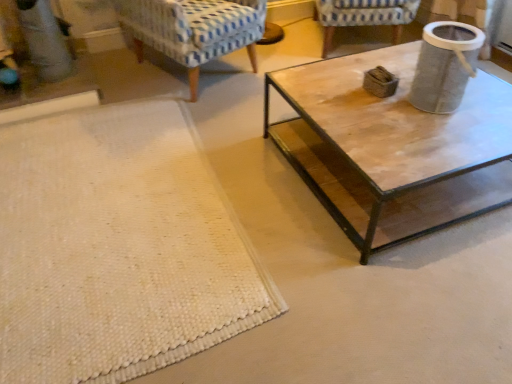
Image resolution: width=512 pixels, height=384 pixels. I want to click on white woven mat at lower left, so click(117, 248).

What is the approximate width of blue-patterned fabric chair at upper center, the 2th chair from the left?

The width of blue-patterned fabric chair at upper center, the 2th chair from the left, is 33.92 inches.

Describe the element at coordinates (445, 66) in the screenshot. The width and height of the screenshot is (512, 384). I see `textured gray trash can at upper right` at that location.

The image size is (512, 384). What are the coordinates of `blue patterned fabric chair at upper left, which is the 2th chair from right to left` in the screenshot? It's located at (193, 29).

Is white woven mat at lower left positioned far away from blue-patterned fabric chair at upper center, the 2th chair from the left?

Absolutely, white woven mat at lower left is distant from blue-patterned fabric chair at upper center, the 2th chair from the left.

Which is less distant, (141, 160) or (414, 1)?

The point (141, 160) is closer to the camera.

From the image's perspective, is white woven mat at lower left above or below blue-patterned fabric chair at upper center, which is the first chair from right to left?

From the image's perspective, white woven mat at lower left appears below blue-patterned fabric chair at upper center, which is the first chair from right to left.

Relative to textured gray trash can at upper right, is white woven mat at lower left in front or behind?

Visually, white woven mat at lower left is located in front of textured gray trash can at upper right.

Considering the relative positions of white woven mat at lower left and textured gray trash can at upper right in the image provided, is white woven mat at lower left to the left of textured gray trash can at upper right from the viewer's perspective?

Yes.

At what (x,y) coordinates should I click in order to perform the action: click on gray behind the white woven mat at lower left. Please return your answer as a coordinate pair (x, y). The width and height of the screenshot is (512, 384). Looking at the image, I should click on (445, 66).

Is textured gray trash can at upper right situated inside blue patterned fabric chair at upper left, which appears as the first chair when viewed from the left, or outside?

The correct answer is: outside.

Between textured gray trash can at upper right and blue patterned fabric chair at upper left, which is the 2th chair from right to left, which one has less height?

textured gray trash can at upper right is shorter.

Between textured gray trash can at upper right and blue patterned fabric chair at upper left, which appears as the first chair when viewed from the left, which one appears on the left side from the viewer's perspective?

From the viewer's perspective, blue patterned fabric chair at upper left, which appears as the first chair when viewed from the left, appears more on the left side.

Based on the photo, which of these two, textured gray trash can at upper right or blue patterned fabric chair at upper left, which is the 2th chair from right to left, is thinner?

textured gray trash can at upper right is thinner.

Considering the positions of objects blue-patterned fabric chair at upper center, the 2th chair from the left, and textured gray trash can at upper right in the image provided, who is in front, blue-patterned fabric chair at upper center, the 2th chair from the left, or textured gray trash can at upper right?

textured gray trash can at upper right.

From a real-world perspective, is blue-patterned fabric chair at upper center, the 2th chair from the left, physically above textured gray trash can at upper right?

No, from a real-world perspective, blue-patterned fabric chair at upper center, the 2th chair from the left, is not over textured gray trash can at upper right

What's the angular difference between blue-patterned fabric chair at upper center, the 2th chair from the left, and textured gray trash can at upper right's facing directions?

68 degrees separate the facing orientations of blue-patterned fabric chair at upper center, the 2th chair from the left, and textured gray trash can at upper right.

Would you say blue patterned fabric chair at upper left, which appears as the first chair when viewed from the left, is a long distance from blue-patterned fabric chair at upper center, which is the first chair from right to left?

blue patterned fabric chair at upper left, which appears as the first chair when viewed from the left, is positioned a significant distance from blue-patterned fabric chair at upper center, which is the first chair from right to left.

From a real-world perspective, is blue patterned fabric chair at upper left, which is the 2th chair from right to left, below blue-patterned fabric chair at upper center, which is the first chair from right to left?

No, from a real-world perspective, blue patterned fabric chair at upper left, which is the 2th chair from right to left, is not under blue-patterned fabric chair at upper center, which is the first chair from right to left.

Is blue patterned fabric chair at upper left, which is the 2th chair from right to left, turned away from blue-patterned fabric chair at upper center, which is the first chair from right to left?

blue patterned fabric chair at upper left, which is the 2th chair from right to left, is not turned away from blue-patterned fabric chair at upper center, which is the first chair from right to left.

How many degrees apart are the facing directions of blue patterned fabric chair at upper left, which appears as the first chair when viewed from the left, and blue-patterned fabric chair at upper center, the 2th chair from the left?

There is a 41.7-degree angle between the facing directions of blue patterned fabric chair at upper left, which appears as the first chair when viewed from the left, and blue-patterned fabric chair at upper center, the 2th chair from the left.

Considering the relative positions of blue patterned fabric chair at upper left, which is the 2th chair from right to left, and textured gray trash can at upper right in the image provided, is blue patterned fabric chair at upper left, which is the 2th chair from right to left, to the left or to the right of textured gray trash can at upper right?

From the image, it's evident that blue patterned fabric chair at upper left, which is the 2th chair from right to left, is to the left of textured gray trash can at upper right.

From the image's perspective, which one is positioned lower, blue patterned fabric chair at upper left, which is the 2th chair from right to left, or textured gray trash can at upper right?

From the image's view, textured gray trash can at upper right is below.

Considering the relative sizes of blue patterned fabric chair at upper left, which appears as the first chair when viewed from the left, and textured gray trash can at upper right in the image provided, is blue patterned fabric chair at upper left, which appears as the first chair when viewed from the left, bigger than textured gray trash can at upper right?

Correct, blue patterned fabric chair at upper left, which appears as the first chair when viewed from the left, is larger in size than textured gray trash can at upper right.

Locate an element on the screen. The width and height of the screenshot is (512, 384). chair that is the 2nd one above the white woven mat at lower left (from a real-world perspective) is located at coordinates (193, 29).

Measure the distance from white woven mat at lower left to blue patterned fabric chair at upper left, which appears as the first chair when viewed from the left.

They are 1.03 meters apart.

Can you confirm if white woven mat at lower left is smaller than blue patterned fabric chair at upper left, which appears as the first chair when viewed from the left?

Yes, white woven mat at lower left is smaller than blue patterned fabric chair at upper left, which appears as the first chair when viewed from the left.

Which chair is the 2nd one when counting from the back of the white woven mat at lower left? Please provide its 2D coordinates.

[(362, 16)]

At what (x,y) coordinates should I click in order to perform the action: click on mat in front of the textured gray trash can at upper right. Please return your answer as a coordinate pair (x, y). This screenshot has height=384, width=512. Looking at the image, I should click on (117, 248).

Considering their positions, is blue-patterned fabric chair at upper center, the 2th chair from the left, positioned further to blue patterned fabric chair at upper left, which is the 2th chair from right to left, than white woven mat at lower left?

blue-patterned fabric chair at upper center, the 2th chair from the left, is further to blue patterned fabric chair at upper left, which is the 2th chair from right to left.

From the image, which object appears to be farther from textured gray trash can at upper right, blue patterned fabric chair at upper left, which is the 2th chair from right to left, or white woven mat at lower left?

blue patterned fabric chair at upper left, which is the 2th chair from right to left, lies further to textured gray trash can at upper right than the other object.

Looking at the image, which one is located closer to white woven mat at lower left, blue patterned fabric chair at upper left, which appears as the first chair when viewed from the left, or blue-patterned fabric chair at upper center, which is the first chair from right to left?

The object closer to white woven mat at lower left is blue patterned fabric chair at upper left, which appears as the first chair when viewed from the left.

Which object lies further to the anchor point blue patterned fabric chair at upper left, which appears as the first chair when viewed from the left, textured gray trash can at upper right or blue-patterned fabric chair at upper center, the 2th chair from the left?

textured gray trash can at upper right lies further to blue patterned fabric chair at upper left, which appears as the first chair when viewed from the left, than the other object.

Considering their positions, is white woven mat at lower left positioned further to blue patterned fabric chair at upper left, which appears as the first chair when viewed from the left, than textured gray trash can at upper right?

textured gray trash can at upper right is further to blue patterned fabric chair at upper left, which appears as the first chair when viewed from the left.

Looking at the image, which one is located closer to white woven mat at lower left, textured gray trash can at upper right or blue patterned fabric chair at upper left, which is the 2th chair from right to left?

Based on the image, blue patterned fabric chair at upper left, which is the 2th chair from right to left, appears to be nearer to white woven mat at lower left.

From the image, which object appears to be nearer to blue patterned fabric chair at upper left, which appears as the first chair when viewed from the left, textured gray trash can at upper right or white woven mat at lower left?

white woven mat at lower left is closer to blue patterned fabric chair at upper left, which appears as the first chair when viewed from the left.

Which object lies nearer to the anchor point textured gray trash can at upper right, white woven mat at lower left or blue patterned fabric chair at upper left, which is the 2th chair from right to left?

white woven mat at lower left lies closer to textured gray trash can at upper right than the other object.

Image resolution: width=512 pixels, height=384 pixels. What are the coordinates of `chair between white woven mat at lower left and blue-patterned fabric chair at upper center, which is the first chair from right to left, from front to back` in the screenshot? It's located at (193, 29).

This screenshot has width=512, height=384. I want to click on chair between blue patterned fabric chair at upper left, which appears as the first chair when viewed from the left, and textured gray trash can at upper right, so click(x=362, y=16).